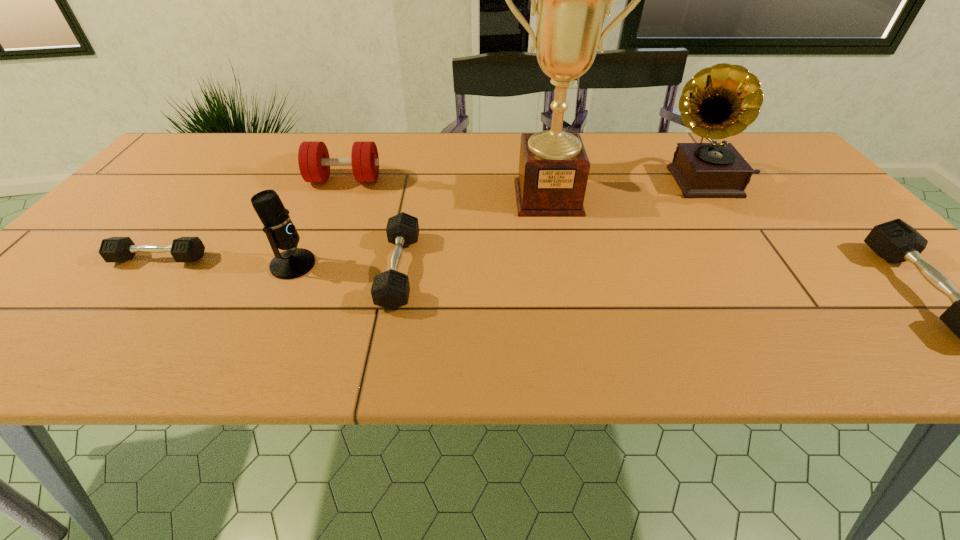
Where is `the leftmost object`? the leftmost object is located at coordinates (115, 249).

Where is `the shortest object`? The height and width of the screenshot is (540, 960). the shortest object is located at coordinates (115, 249).

Find the location of a particular element. The width and height of the screenshot is (960, 540). the third dumbbell from left to right is located at coordinates (390, 289).

The image size is (960, 540). Identify the location of the third tallest dumbbell. (390, 289).

Locate an element on the screen. Image resolution: width=960 pixels, height=540 pixels. trophy cup is located at coordinates (572, 0).

Where is `the tallest object`? the tallest object is located at coordinates (572, 0).

At what (x,y) coordinates should I click in order to perform the action: click on the sixth shortest object. Please return your answer as a coordinate pair (x, y). Image resolution: width=960 pixels, height=540 pixels. Looking at the image, I should click on (720, 101).

At what (x,y) coordinates should I click in order to perform the action: click on the second object from right to left. Please return your answer as a coordinate pair (x, y). Looking at the image, I should click on (720, 101).

This screenshot has height=540, width=960. Identify the location of the tallest dumbbell. point(314,162).

Locate an element on the screen. This screenshot has height=540, width=960. the farthest dumbbell is located at coordinates (314, 162).